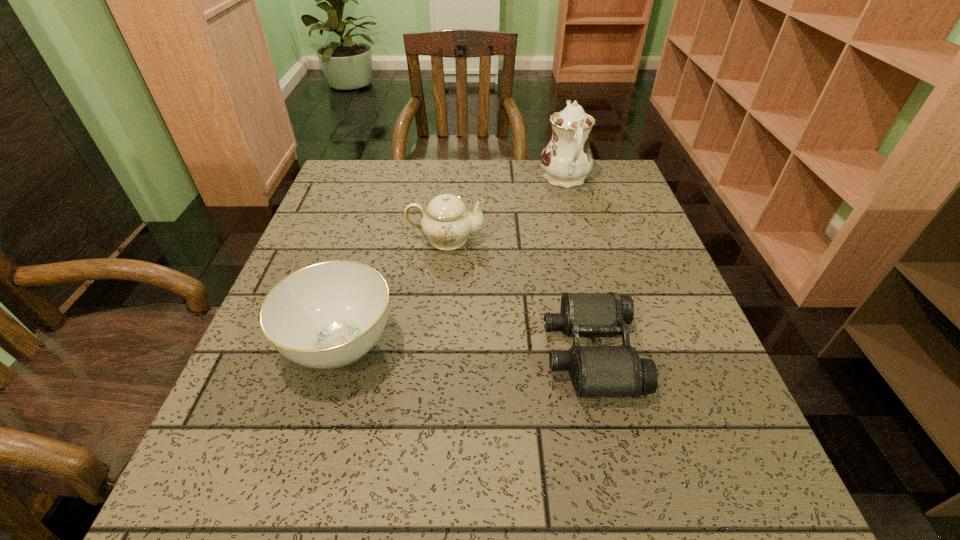
The image size is (960, 540). I want to click on vacant space at the far left corner, so click(339, 196).

Locate an element on the screen. blank space at the far right corner of the desktop is located at coordinates (631, 185).

At what (x,y) coordinates should I click in order to perform the action: click on free space at the near right corner. Please return your answer as a coordinate pair (x, y). Looking at the image, I should click on (742, 522).

Find the location of a particular element. blank region between the nearest chinaware and the tallest chinaware is located at coordinates (452, 262).

At what (x,y) coordinates should I click in order to perform the action: click on free space between the shortest object and the tallest chinaware. Please return your answer as a coordinate pair (x, y). The image size is (960, 540). Looking at the image, I should click on (578, 265).

I want to click on free space between the shortest object and the nearest chinaware, so click(466, 349).

At what (x,y) coordinates should I click in order to perform the action: click on vacant area between the nearest chinaware and the second nearest chinaware. Please return your answer as a coordinate pair (x, y). The image size is (960, 540). Looking at the image, I should click on (394, 292).

You are a GUI agent. You are given a task and a screenshot of the screen. Output one action in this format:
    pyautogui.click(x=<x>, y=<y>)
    Task: Click on the free space between the farthest chinaware and the shortest object
    The image size is (960, 540).
    Given the screenshot: What is the action you would take?
    pyautogui.click(x=578, y=265)

The image size is (960, 540). What are the coordinates of `free space between the third nearest object and the nearest chinaware` in the screenshot? It's located at (394, 292).

The width and height of the screenshot is (960, 540). I want to click on blank region between the nearest chinaware and the second nearest chinaware, so click(394, 292).